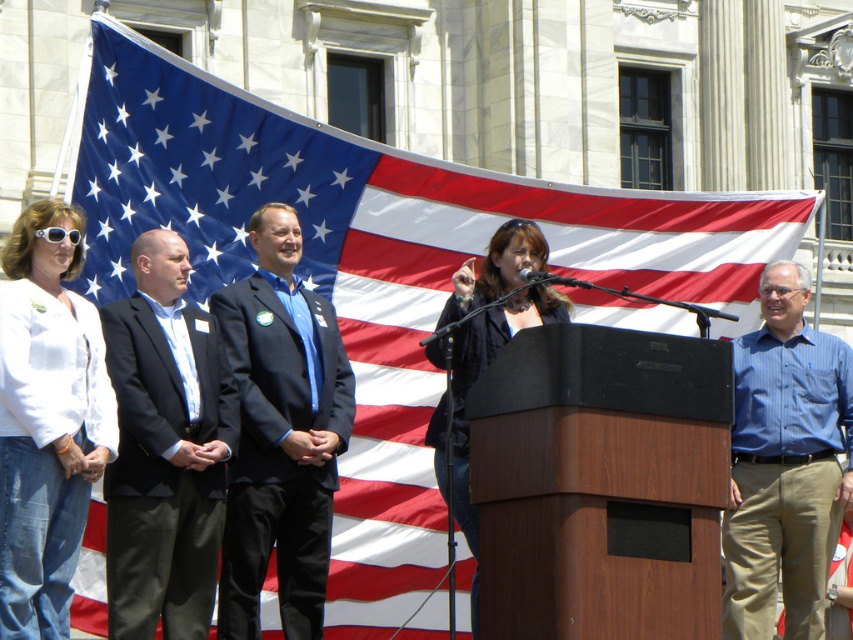
You are organizing a photo shoot at the event and need to position two models wearing the black suit at center and the denim jacket at center. What is the minimum distance you should maintain between them to ensure they are placed exactly as shown in the image?

The minimum distance you should maintain between the black suit at center and the denim jacket at center is 7.33 meters to match their positions in the image.

You are attending this event and need to know who is taller between the dark blue suit at center and the blue striped shirt at right. Can you determine this based on their positions?

The dark blue suit at center is not as tall as the blue striped shirt at right, so the blue striped shirt at right is taller.